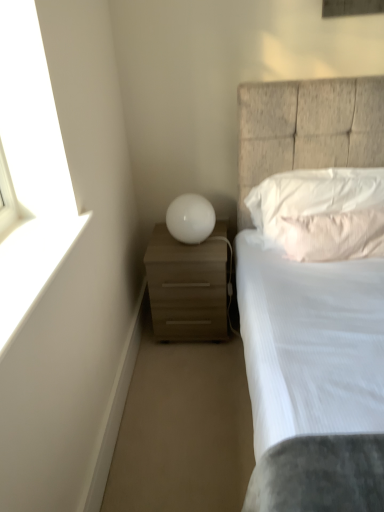
Image resolution: width=384 pixels, height=512 pixels. I want to click on vacant area on top of pink textured pillow at upper right, which is the 2th pillow in top-to-bottom order (from a real-world perspective), so click(359, 205).